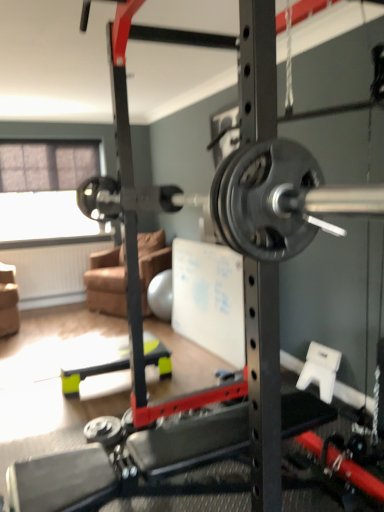
The height and width of the screenshot is (512, 384). I want to click on brown fabric couch at center, so click(107, 282).

What do you see at coordinates (107, 282) in the screenshot?
I see `brown fabric couch at center` at bounding box center [107, 282].

Measure the distance between transparent fabric at left and camera.

transparent fabric at left is 16.07 feet away from camera.

Locate an element on the screen. Image resolution: width=384 pixels, height=512 pixels. transparent fabric at left is located at coordinates (46, 191).

What do you see at coordinates (46, 191) in the screenshot? I see `transparent fabric at left` at bounding box center [46, 191].

In order to face transparent fabric at left, should I rotate leftwards or rightwards?

You should look left and rotate roughly 18.098 degrees.

Image resolution: width=384 pixels, height=512 pixels. I want to click on brown fabric couch at center, so click(107, 282).

Is brown fabric couch at center to the left of transparent fabric at left from the viewer's perspective?

No, brown fabric couch at center is not to the left of transparent fabric at left.

Which object is further away from the camera taking this photo, brown fabric couch at center or transparent fabric at left?

transparent fabric at left is further away from the camera.

Does point (140, 236) come in front of point (40, 190)?

Yes, it is in front of point (40, 190).

From the image's perspective, which is below, brown fabric couch at center or transparent fabric at left?

brown fabric couch at center is shown below in the image.

From a real-world perspective, is brown fabric couch at center physically below transparent fabric at left?

Yes, from a real-world perspective, brown fabric couch at center is beneath transparent fabric at left.

Considering the relative sizes of brown fabric couch at center and transparent fabric at left in the image provided, is brown fabric couch at center thinner than transparent fabric at left?

Incorrect, the width of brown fabric couch at center is not less than that of transparent fabric at left.

In the scene shown: Does brown fabric couch at center have a greater height compared to transparent fabric at left?

In fact, brown fabric couch at center may be shorter than transparent fabric at left.

Looking at the image, does brown fabric couch at center seem bigger or smaller compared to transparent fabric at left?

Clearly, brown fabric couch at center is larger in size than transparent fabric at left.

Is brown fabric couch at center outside of transparent fabric at left?

Yes, brown fabric couch at center is located beyond the bounds of transparent fabric at left.

Consider the image. Are brown fabric couch at center and transparent fabric at left making contact?

There is a gap between brown fabric couch at center and transparent fabric at left.

From the picture: Is brown fabric couch at center turned away from transparent fabric at left?

No, brown fabric couch at center's orientation is not away from transparent fabric at left.

In order to click on couch below the transparent fabric at left (from the image's perspective) in this screenshot , I will do `click(107, 282)`.

Which object is positioned more to the right, transparent fabric at left or brown fabric couch at center?

Positioned to the right is brown fabric couch at center.

Relative to brown fabric couch at center, is transparent fabric at left in front or behind?

Clearly, transparent fabric at left is behind brown fabric couch at center.

Between point (75, 210) and point (159, 238), which one is positioned behind?

The point (75, 210) is more distant.

From the image's perspective, between transparent fabric at left and brown fabric couch at center, which one is located above?

transparent fabric at left appears higher in the image.

From a real-world perspective, is transparent fabric at left positioned over brown fabric couch at center based on gravity?

Yes, from a real-world perspective, transparent fabric at left is on top of brown fabric couch at center.

Considering the sizes of objects transparent fabric at left and brown fabric couch at center in the image provided, who is wider, transparent fabric at left or brown fabric couch at center?

Wider between the two is brown fabric couch at center.

Considering the sizes of objects transparent fabric at left and brown fabric couch at center in the image provided, who is taller, transparent fabric at left or brown fabric couch at center?

With more height is transparent fabric at left.

Which of these two, transparent fabric at left or brown fabric couch at center, is bigger?

Bigger between the two is brown fabric couch at center.

Is transparent fabric at left located outside brown fabric couch at center?

Yes, transparent fabric at left is outside of brown fabric couch at center.

Is transparent fabric at left in contact with brown fabric couch at center?

No, transparent fabric at left is not in contact with brown fabric couch at center.

Is transparent fabric at left oriented towards brown fabric couch at center?

No, transparent fabric at left is not facing towards brown fabric couch at center.

Locate an element on the screen. window screen located behind the brown fabric couch at center is located at coordinates (46, 191).

Find the location of `window screen that appears behind the brown fabric couch at center`. window screen that appears behind the brown fabric couch at center is located at coordinates (46, 191).

At what (x,y) coordinates should I click in order to perform the action: click on window screen that is above the brown fabric couch at center (from the image's perspective). Please return your answer as a coordinate pair (x, y). Looking at the image, I should click on (46, 191).